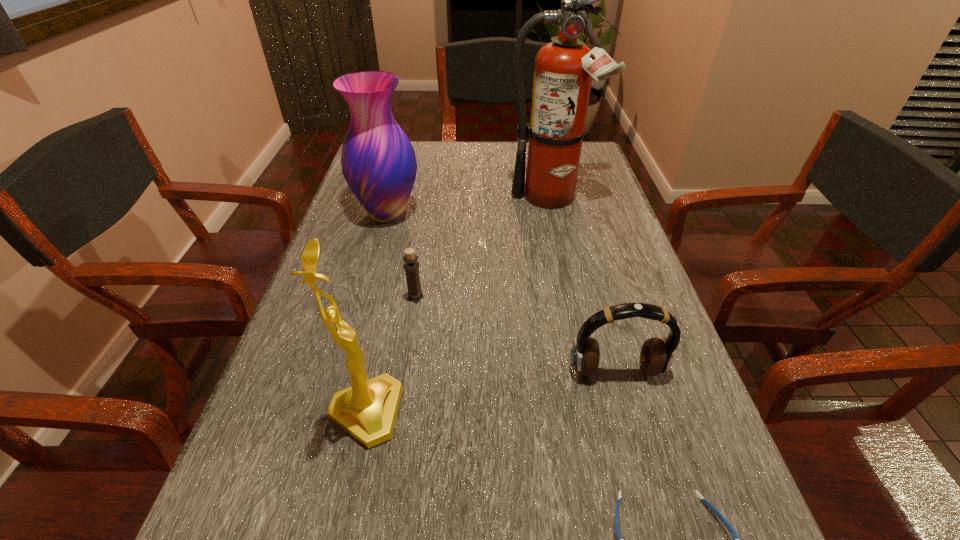
Locate an element on the screen. This screenshot has height=540, width=960. fire extinguisher is located at coordinates (564, 68).

I want to click on vase, so click(x=378, y=161).

Locate an element on the screen. The width and height of the screenshot is (960, 540). award is located at coordinates (367, 410).

This screenshot has height=540, width=960. What are the coordinates of `the third shortest object` in the screenshot? It's located at (656, 356).

I want to click on the third farthest object, so click(x=411, y=265).

At what (x,y) coordinates should I click in order to perform the action: click on candle holder. Please return your answer as a coordinate pair (x, y). The height and width of the screenshot is (540, 960). Looking at the image, I should click on (411, 265).

Identify the location of vacant region located from the nozzle of the tallest object. This screenshot has height=540, width=960. (578, 327).

The width and height of the screenshot is (960, 540). Identify the location of vacant space located 0.140m on the front of the vase. (372, 270).

The height and width of the screenshot is (540, 960). Identify the location of free space located 0.260m on the front-facing side of the award. (554, 413).

Find the location of a particular element. This screenshot has width=960, height=540. free location located on the ear cup of the headset is located at coordinates (651, 494).